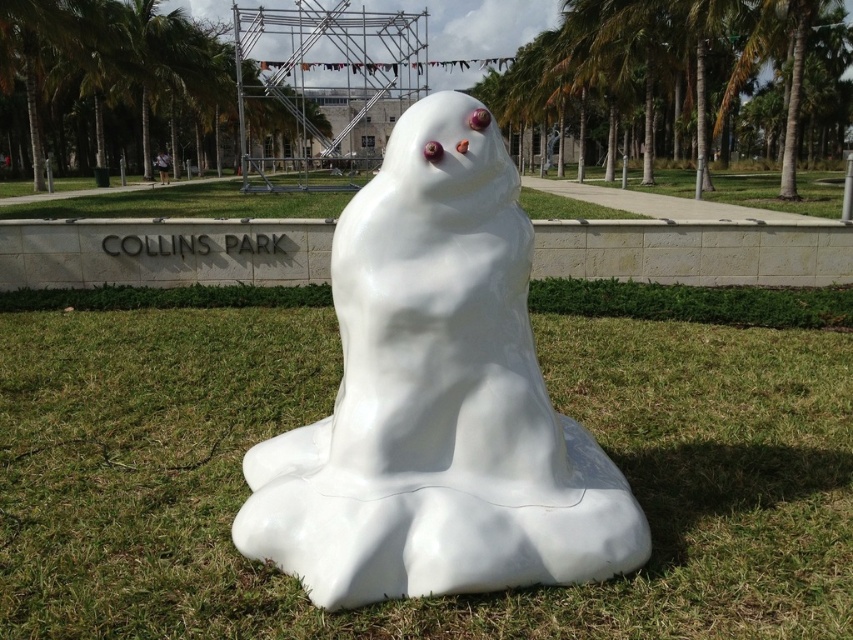
You are standing in Collins Park and see the white glossy ghost at center and the white grass at center. Which object is located lower in the scene?

The white grass at center is located below the white glossy ghost at center, so the white grass at center is lower in the scene.

You are a gardener in Collins Park who needs to mow the lawn. You see the white grass at center and the white glossy ghost at center. Which object is taller so you can avoid hitting it with the lawnmower?

The white glossy ghost at center is taller than the white grass at center, so you should avoid hitting it with the lawnmower.

You are standing in Collins Park and see the white grass at center and the white glossy ghost at center. Which object is located to the right side?

The white glossy ghost at center is located to the right side of the white grass at center.